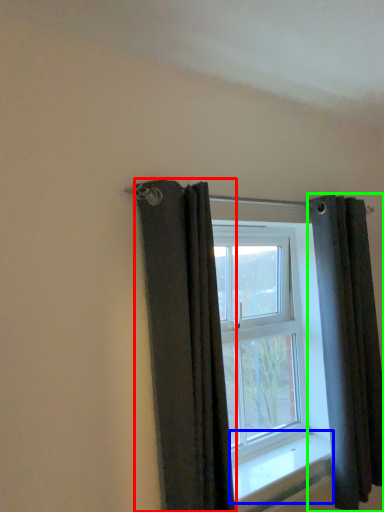
Question: Which object is positioned closest to curtain (highlighted by a red box)? Select from window sill (highlighted by a blue box) and curtain (highlighted by a green box).

Choices:
 (A) window sill
 (B) curtain

Answer: (A)